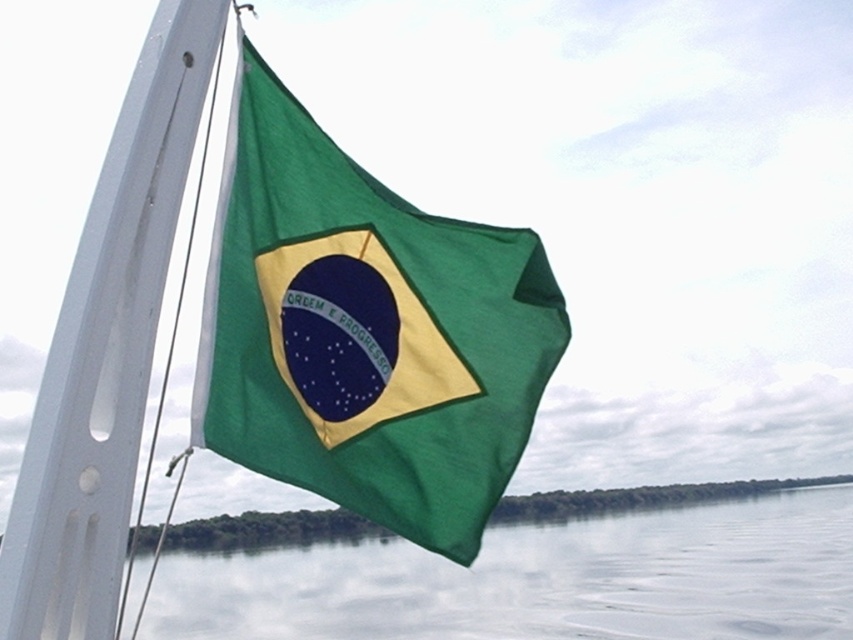
In the scene shown: You are a photographer trying to capture the green fabric flag at center and the white matte flag pole at left. Which object is closer to your camera lens?

The green fabric flag at center is closer to the camera lens because it is further to the viewer than the white matte flag pole at left.

In the scene shown: You are a photographer taking a picture of the green fabric flag at center from a boat. The flag is located at point (364, 332). If you want to adjust your camera to focus on the flag, which coordinates should you aim for?

The green fabric flag at center is located at point (364, 332), so you should aim your camera at those coordinates to focus on it.

You are navigating a boat and need to adjust the green fabric flag at center to avoid it from dipping into the water. Based on its current position, which direction should you move it to keep it above the water level?

The green fabric flag at center is located at point coordinates, so moving it upwards would keep it above the water level.